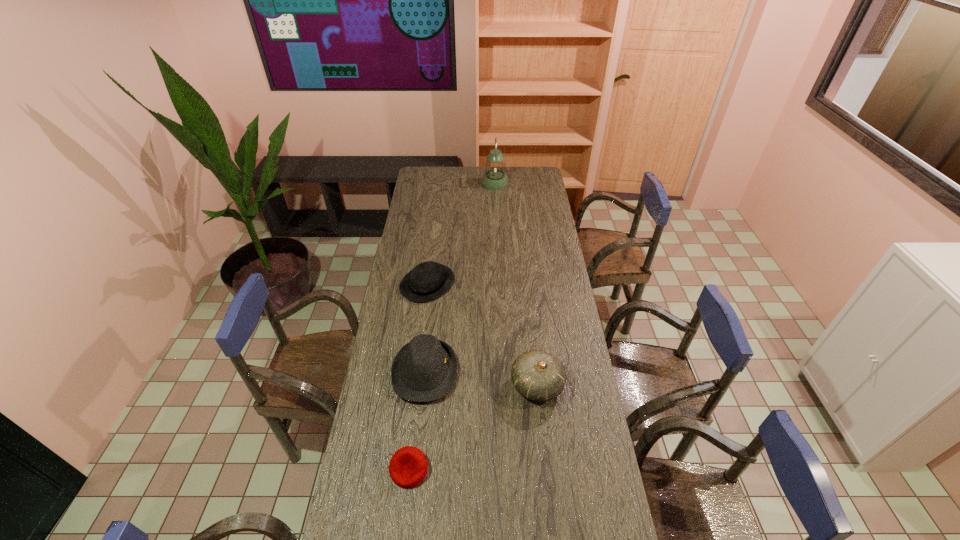
I want to click on vacant region located on the front-facing side of the nearer fedora, so click(564, 372).

Find the location of a particular element. This screenshot has height=540, width=960. vacant space located on the right of the second farthest object is located at coordinates (492, 284).

This screenshot has width=960, height=540. What are the coordinates of `free location located 0.110m on the seat area of the nearest object` in the screenshot? It's located at (402, 529).

Locate an element on the screen. The width and height of the screenshot is (960, 540). object located in the far edge section of the desktop is located at coordinates (495, 178).

Identify the location of beanbag that is at the left edge. (408, 467).

Find the location of a particular element. Image resolution: width=960 pixels, height=540 pixels. object at the right edge is located at coordinates (537, 375).

The height and width of the screenshot is (540, 960). In the image, there is a desktop. What are the coordinates of `vacant region at the far edge` in the screenshot? It's located at (448, 181).

Find the location of a particular element. This screenshot has height=540, width=960. free location at the left edge is located at coordinates (385, 338).

The height and width of the screenshot is (540, 960). I want to click on vacant space at the right edge, so click(x=580, y=348).

You are a GUI agent. You are given a task and a screenshot of the screen. Output one action in this format:
    pyautogui.click(x=<x>, y=<y>)
    Task: Click on the free space between the farther fedora and the third shortest object
    The image size is (960, 540).
    Given the screenshot: What is the action you would take?
    pyautogui.click(x=426, y=328)